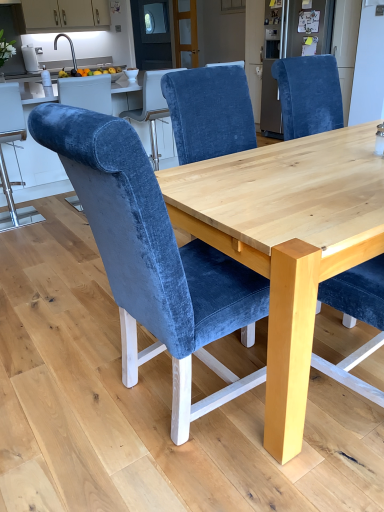
Where is `free location above natural wood table at center (from a real-world perspective)`? Image resolution: width=384 pixels, height=512 pixels. free location above natural wood table at center (from a real-world perspective) is located at coordinates (316, 177).